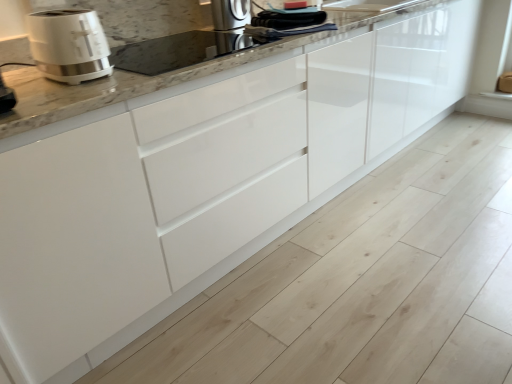
You are a GUI agent. You are given a task and a screenshot of the screen. Output one action in this format:
    pyautogui.click(x=<x>, y=<y>)
    Task: Click on the white glossy toaster at upper left
    The image size is (512, 384).
    Given the screenshot: What is the action you would take?
    click(x=69, y=45)

What do you see at coordinates (69, 45) in the screenshot? Image resolution: width=512 pixels, height=384 pixels. I see `white glossy toaster at upper left` at bounding box center [69, 45].

Locate an element on the screen. This screenshot has width=512, height=384. white glossy toaster at upper left is located at coordinates (69, 45).